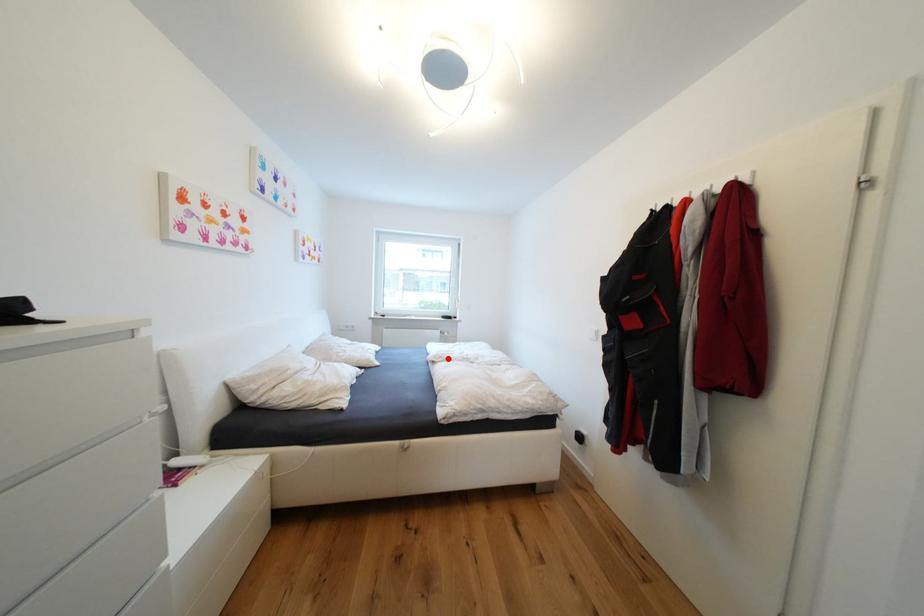
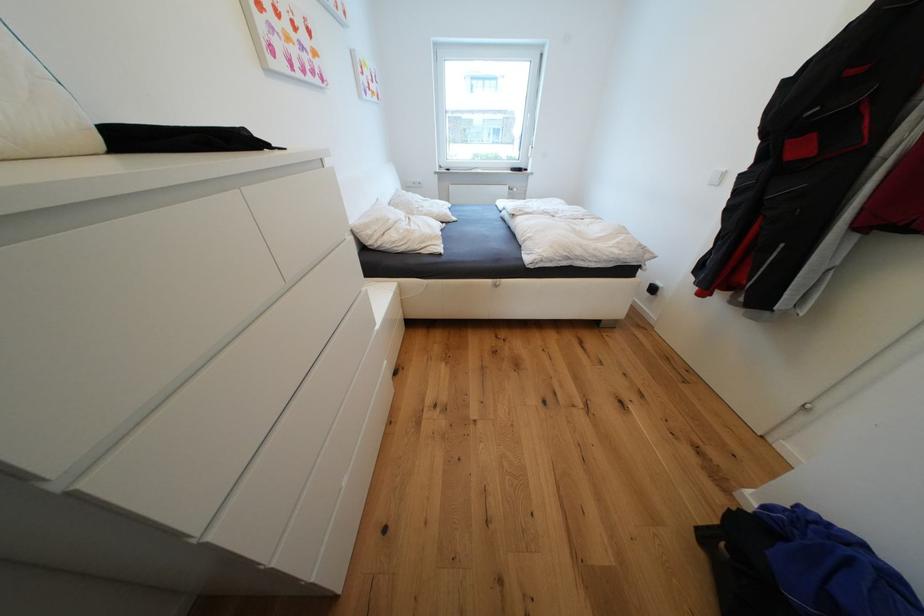
Where in the second image is the point corresponding to the highlighted location from the first image?

(528, 212)